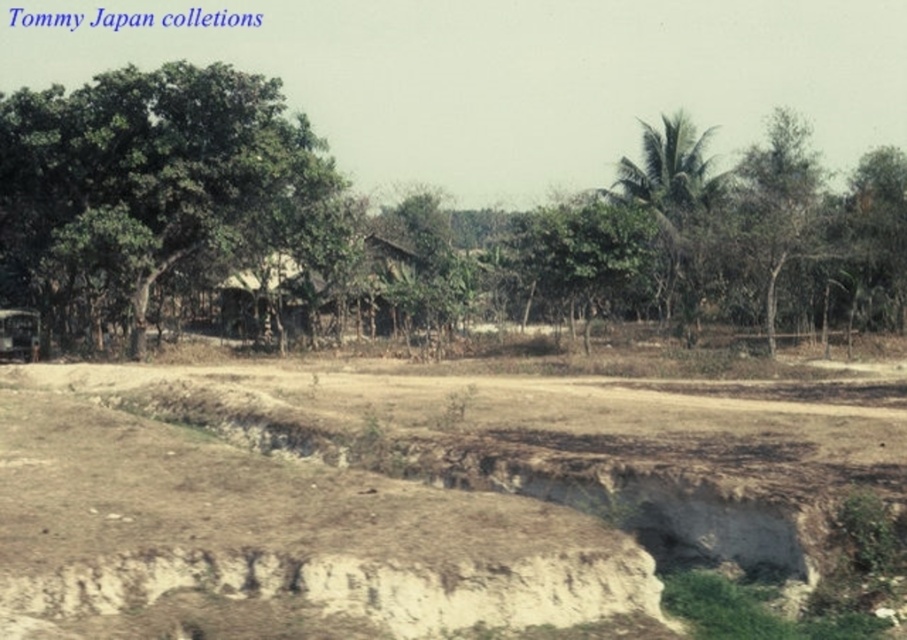
Consider the image. Does green leafy tree at left appear on the left side of brown wooden hut at center?

Indeed, green leafy tree at left is positioned on the left side of brown wooden hut at center.

Is green leafy tree at left shorter than brown wooden hut at center?

No.

Find the location of a particular element. green leafy tree at left is located at coordinates (158, 173).

Can you confirm if brown sandy dirt field at center is smaller than green leafy tree at upper right?

Yes.

Does brown sandy dirt field at center have a greater width compared to green leafy tree at upper right?

Correct, the width of brown sandy dirt field at center exceeds that of green leafy tree at upper right.

What do you see at coordinates (401, 499) in the screenshot? I see `brown sandy dirt field at center` at bounding box center [401, 499].

I want to click on brown sandy dirt field at center, so click(401, 499).

Does brown sandy dirt field at center appear on the right side of green leafy tree at left?

Correct, you'll find brown sandy dirt field at center to the right of green leafy tree at left.

Between point (168, 573) and point (111, 248), which one is positioned in front?

Point (168, 573)

Where is `brown sandy dirt field at center`? brown sandy dirt field at center is located at coordinates (401, 499).